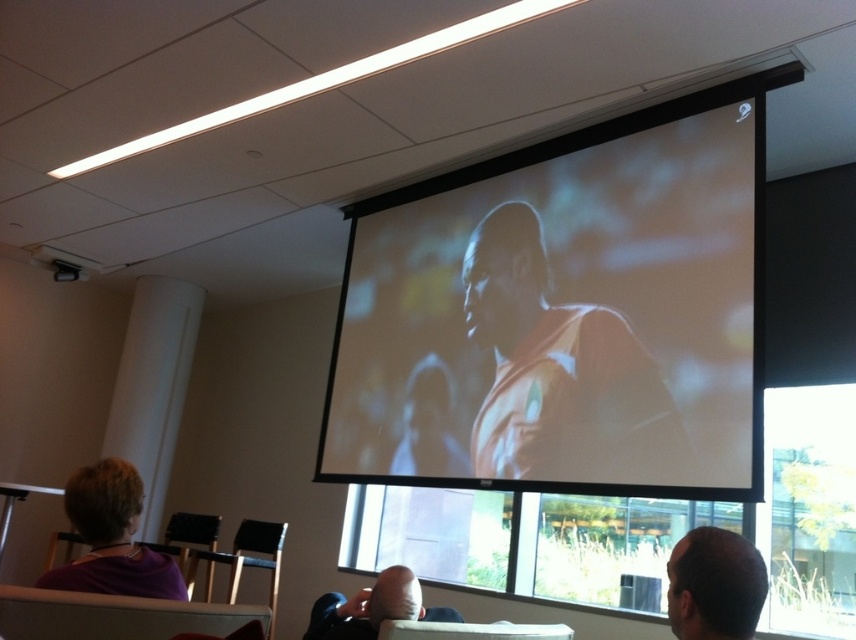
You are sitting in the metallic silver chair at lower left and want to look at the orange fabric screen at center. In which direction should you turn your head?

The orange fabric screen at center is positioned on the right side of the metallic silver chair at lower left, so you should turn your head to the right to look at it.